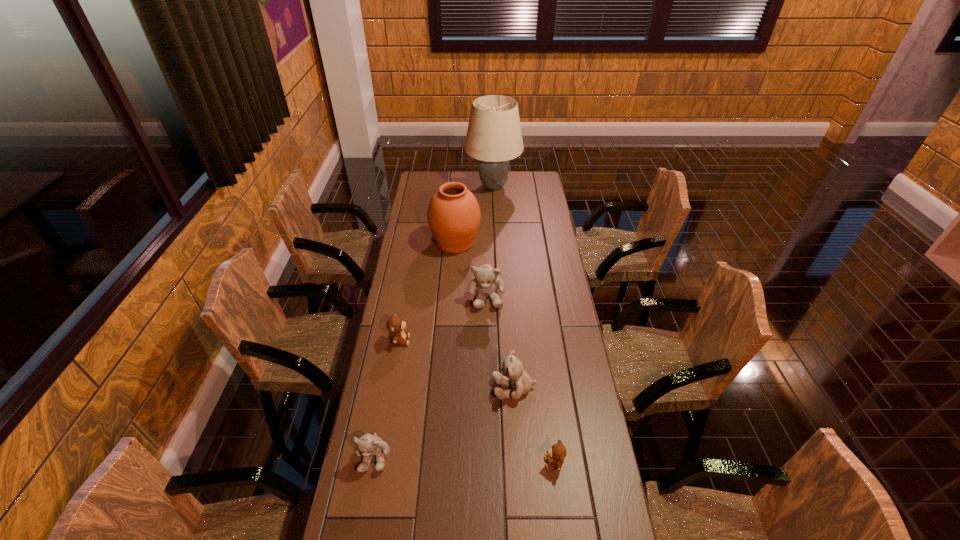
Where is `free spot located 0.250m on the face of the bigger brown teddy bear`? The height and width of the screenshot is (540, 960). free spot located 0.250m on the face of the bigger brown teddy bear is located at coordinates (477, 340).

Where is `vacant region located 0.160m on the face of the smallest gray teddy bear`? This screenshot has height=540, width=960. vacant region located 0.160m on the face of the smallest gray teddy bear is located at coordinates (359, 536).

Find the location of `vacant space located 0.090m on the face of the smaller brown teddy bear`. vacant space located 0.090m on the face of the smaller brown teddy bear is located at coordinates (515, 463).

The width and height of the screenshot is (960, 540). Identify the location of vacant space located on the face of the smaller brown teddy bear. (528, 463).

At what (x,y) coordinates should I click in order to perform the action: click on vacant region located on the face of the smaller brown teddy bear. Please return your answer as a coordinate pair (x, y). Looking at the image, I should click on (470, 463).

You are a GUI agent. You are given a task and a screenshot of the screen. Output one action in this format:
    pyautogui.click(x=<x>, y=<y>)
    Task: Click on the object that is at the far edge
    The width and height of the screenshot is (960, 540).
    Given the screenshot: What is the action you would take?
    [494, 136]

The width and height of the screenshot is (960, 540). I want to click on urn that is at the left edge, so click(453, 215).

This screenshot has width=960, height=540. Identify the location of lampshade that is at the right edge. (494, 136).

The image size is (960, 540). What are the coordinates of `teddy bear present at the right edge` in the screenshot? It's located at (556, 454).

Where is `object positioned at the far right corner`? object positioned at the far right corner is located at coordinates (494, 136).